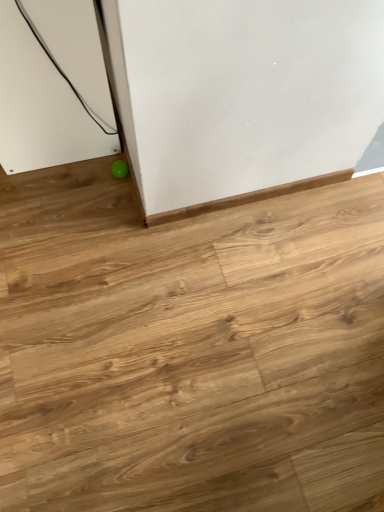
Where is `vacant space situated above light brown wood floor at lower left (from a real-world perspective)`? The width and height of the screenshot is (384, 512). vacant space situated above light brown wood floor at lower left (from a real-world perspective) is located at coordinates click(206, 310).